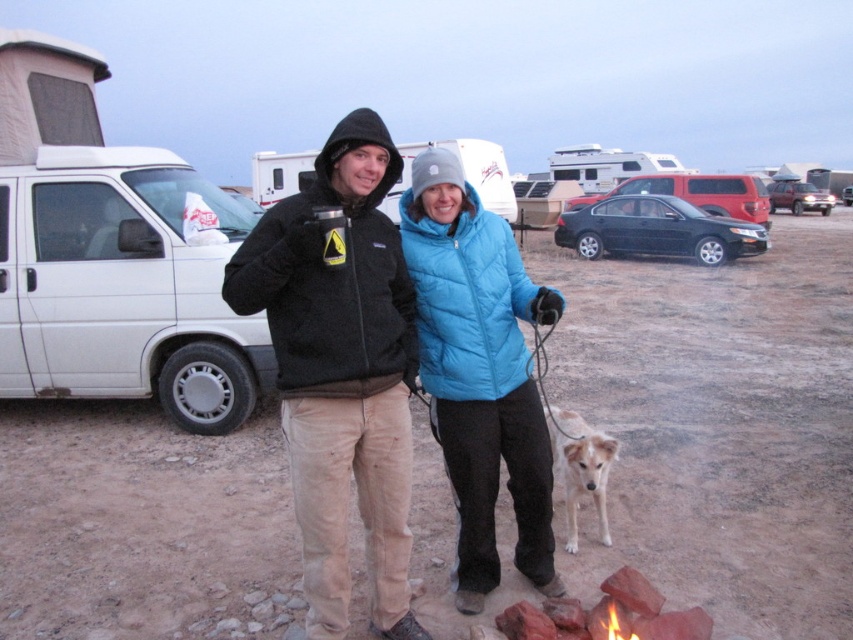
You are planning to park your tall truck and need to choose between the white matte van at left and the satin black sedan at center. Which vehicle should you park next to if you want to maximize space for your truck?

The white matte van at left has a greater height compared to the satin black sedan at center, so you should park next to the satin black sedan at center to maximize space for your tall truck since it is shorter and takes up less vertical space.

You are a photographer trying to capture a photo of the blue puffy vest at center without including the white matte van at left in the frame. Is this possible given their positions?

The white matte van at left is positioned over the blue puffy vest at center, so it would block the view of the blue puffy vest at center. Therefore, it is not possible to capture the blue puffy vest at center without including the white matte van at left in the frame.

What is the color of the van located at the point marked by the coordinates (x=125, y=285) in the image?

The point marked by the coordinates (x=125, y=285) indicates the white matte van at left, so the van is white.